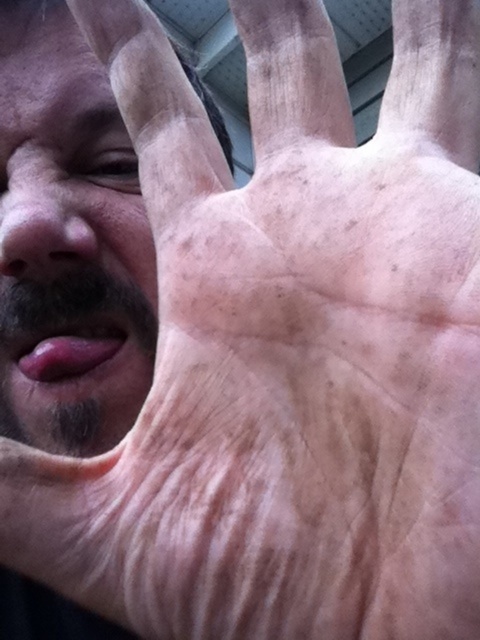
You are an artist trying to paint a portrait of the person in the image. You notice two areas of skin texture differences on the left side of the face. The smooth skin at left and the matte skin nose at left. Which of these two areas is bigger in size?

The smooth skin at left has a larger size compared to the matte skin nose at left, so the smooth skin at left is bigger.

In the scene shown: You are an artist sketching this scene. You notice the smooth skin at left and the matte skin nose at left. Which one should you draw first to maintain proper perspective?

You should draw the smooth skin at left first because it is closer to the viewer than the matte skin nose at left, so it should be placed in front in your sketch.